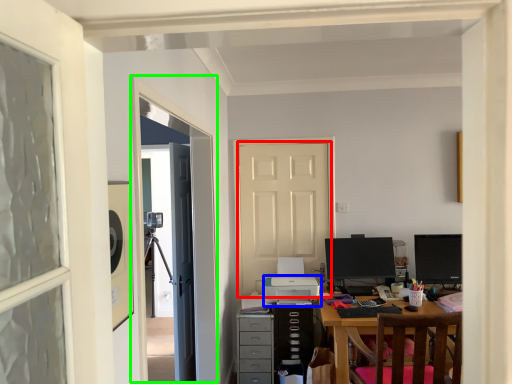
Question: Which object is positioned closest to door (highlighted by a red box)? Select from printer (highlighted by a blue box) and screen door (highlighted by a green box).

Choices:
 (A) printer
 (B) screen door

Answer: (A)